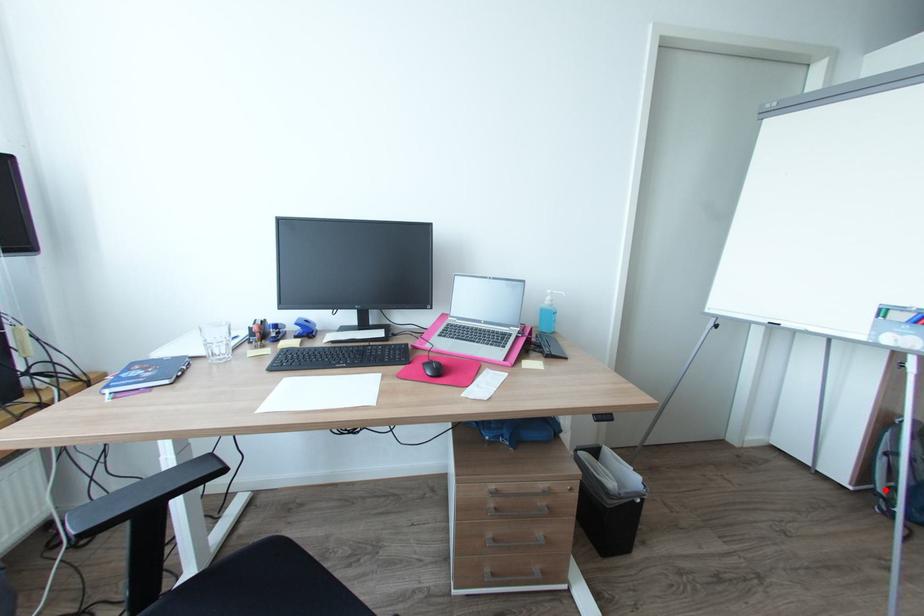
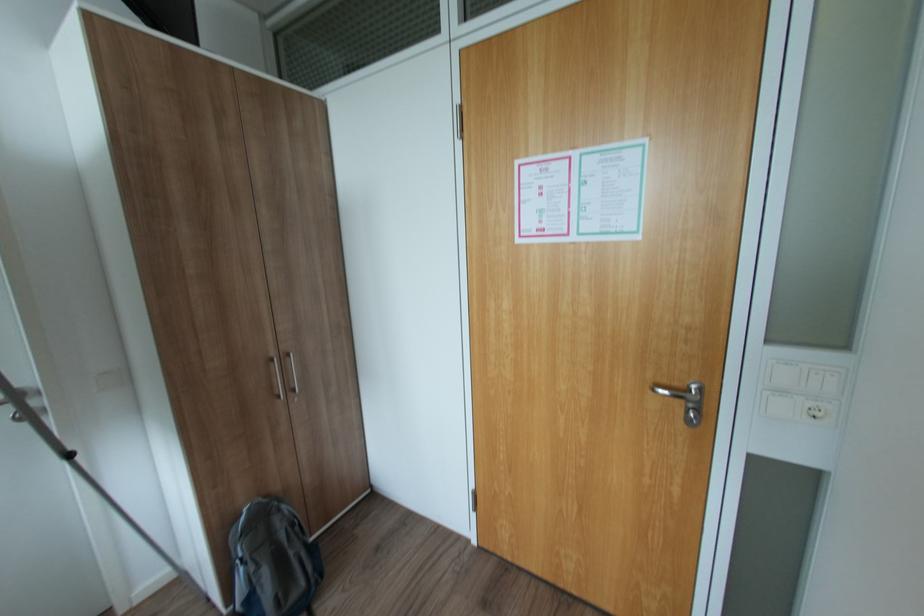
Question: I am providing you with two images of the same scene from different viewpoints. Given a red point in image1, look at the same physical point in image2. Is it:

Choices:
 (A) Closer to the viewpoint
 (B) Farther from the viewpoint

Answer: (B)